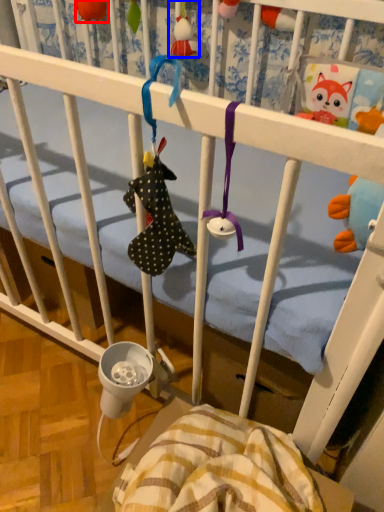
Question: Which point is further to the camera, toy (highlighted by a red box) or toy (highlighted by a blue box)?

Choices:
 (A) toy
 (B) toy

Answer: (A)